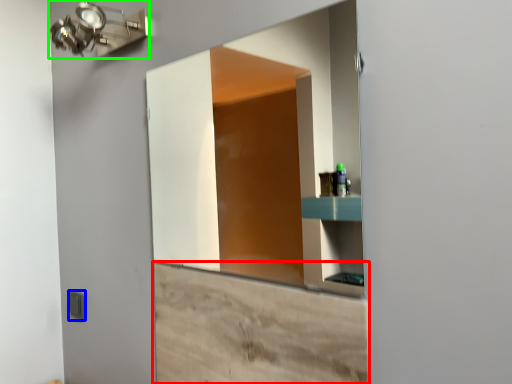
Question: Based on their relative distances, which object is nearer to cabinetry (highlighted by a red box)? Choose from light switch (highlighted by a blue box) and light fixture (highlighted by a green box).

Choices:
 (A) light switch
 (B) light fixture

Answer: (A)